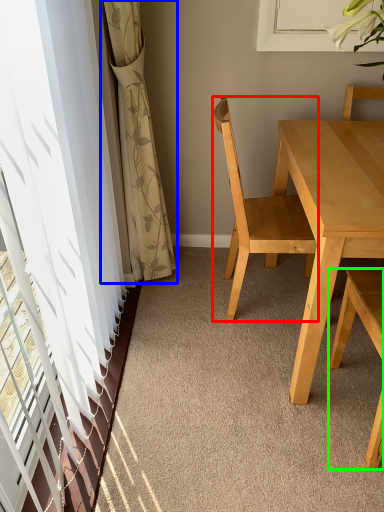
Question: Which object is positioned farthest from chair (highlighted by a red box)? Select from curtain (highlighted by a blue box) and chair (highlighted by a green box).

Choices:
 (A) curtain
 (B) chair

Answer: (A)